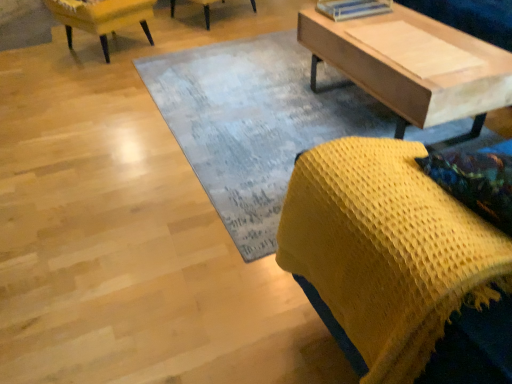
Question: Is yellow knitted blanket at lower right, the 2th chair when ordered from top to bottom, next to light brown wood plank at upper right?

Choices:
 (A) yes
 (B) no

Answer: (B)

Question: Considering the relative sizes of yellow knitted blanket at lower right, the 2th chair when ordered from top to bottom, and light brown wood plank at upper right in the image provided, is yellow knitted blanket at lower right, the 2th chair when ordered from top to bottom, wider than light brown wood plank at upper right?

Choices:
 (A) no
 (B) yes

Answer: (B)

Question: Is yellow knitted blanket at lower right, which appears as the 2th chair when viewed from the left, outside light brown wood plank at upper right?

Choices:
 (A) no
 (B) yes

Answer: (B)

Question: Does yellow knitted blanket at lower right, which appears as the 2th chair when viewed from the left, come behind light brown wood plank at upper right?

Choices:
 (A) no
 (B) yes

Answer: (A)

Question: Is light brown wood plank at upper right surrounded by yellow knitted blanket at lower right, arranged as the 1th chair when viewed from the front?

Choices:
 (A) no
 (B) yes

Answer: (A)

Question: From a real-world perspective, is yellow knitted blanket at lower right, arranged as the 1th chair when viewed from the front, beneath light brown wood plank at upper right?

Choices:
 (A) yes
 (B) no

Answer: (B)

Question: Is light brown wood plank at upper right further to the viewer compared to yellow knitted blanket at lower right, the 2th chair when ordered from top to bottom?

Choices:
 (A) no
 (B) yes

Answer: (B)

Question: From the image's perspective, does light brown wood plank at upper right appear lower than yellow knitted blanket at lower right, arranged as the 1th chair when viewed from the front?

Choices:
 (A) no
 (B) yes

Answer: (A)

Question: Could you tell me if light brown wood plank at upper right is turned towards yellow knitted blanket at lower right, the 2th chair positioned from the back?

Choices:
 (A) no
 (B) yes

Answer: (A)

Question: Is light brown wood plank at upper right positioned with its back to yellow knitted blanket at lower right, the first chair in the right-to-left sequence?

Choices:
 (A) yes
 (B) no

Answer: (B)

Question: From a real-world perspective, does light brown wood plank at upper right stand above yellow knitted blanket at lower right, the 2th chair when ordered from top to bottom?

Choices:
 (A) no
 (B) yes

Answer: (A)

Question: Considering the relative sizes of light brown wood plank at upper right and yellow knitted blanket at lower right, which appears as the 2th chair when viewed from the left, in the image provided, is light brown wood plank at upper right wider than yellow knitted blanket at lower right, which appears as the 2th chair when viewed from the left,?

Choices:
 (A) yes
 (B) no

Answer: (B)

Question: Can light wood coffee table at upper right be found inside yellow knitted blanket at lower right, arranged as the 1th chair when viewed from the front?

Choices:
 (A) yes
 (B) no

Answer: (B)